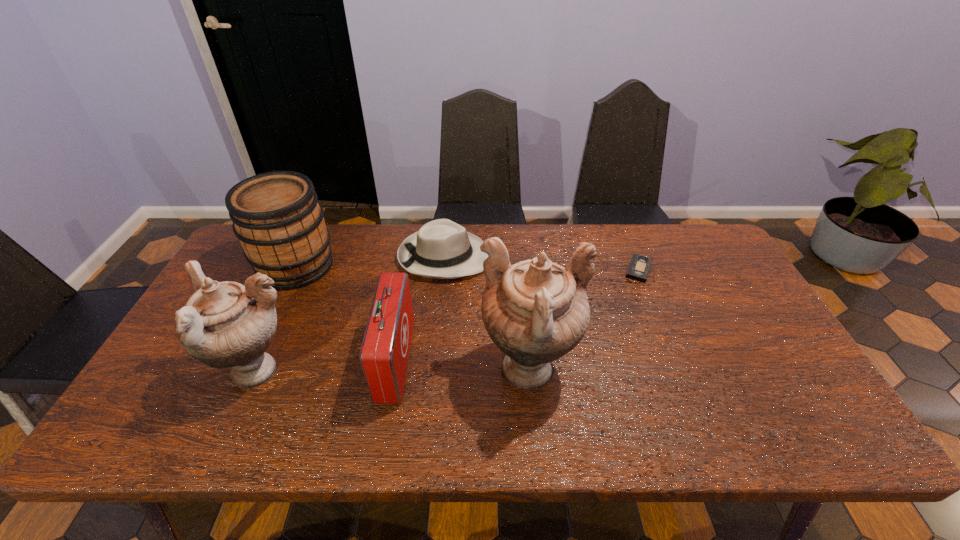
I want to click on vacant region located on the back of the cider, so click(x=314, y=228).

At what (x,y) coordinates should I click in order to perform the action: click on vacant region located on the front-facing side of the second shortest object. Please return your answer as a coordinate pair (x, y). This screenshot has width=960, height=540. Looking at the image, I should click on (608, 257).

Locate an element on the screen. This screenshot has height=540, width=960. vacant region located 0.360m on the left of the shortest object is located at coordinates (508, 269).

This screenshot has height=540, width=960. I want to click on vacant space located on the side of the fourth tallest object with the first aid cross symbol, so click(476, 361).

What are the coordinates of `cider located in the far edge section of the desktop` in the screenshot? It's located at (276, 216).

At what (x,y) coordinates should I click in order to perform the action: click on fedora present at the far edge. Please return your answer as a coordinate pair (x, y). The image size is (960, 540). Looking at the image, I should click on (442, 249).

At what (x,y) coordinates should I click in order to perform the action: click on videotape situated at the far edge. Please return your answer as a coordinate pair (x, y). The height and width of the screenshot is (540, 960). Looking at the image, I should click on (639, 267).

This screenshot has height=540, width=960. I want to click on the first-aid kit positioned at the near edge, so [x=384, y=353].

Identify the location of urn that is at the left edge. (226, 324).

Identify the location of cider present at the left edge. The width and height of the screenshot is (960, 540). point(276,216).